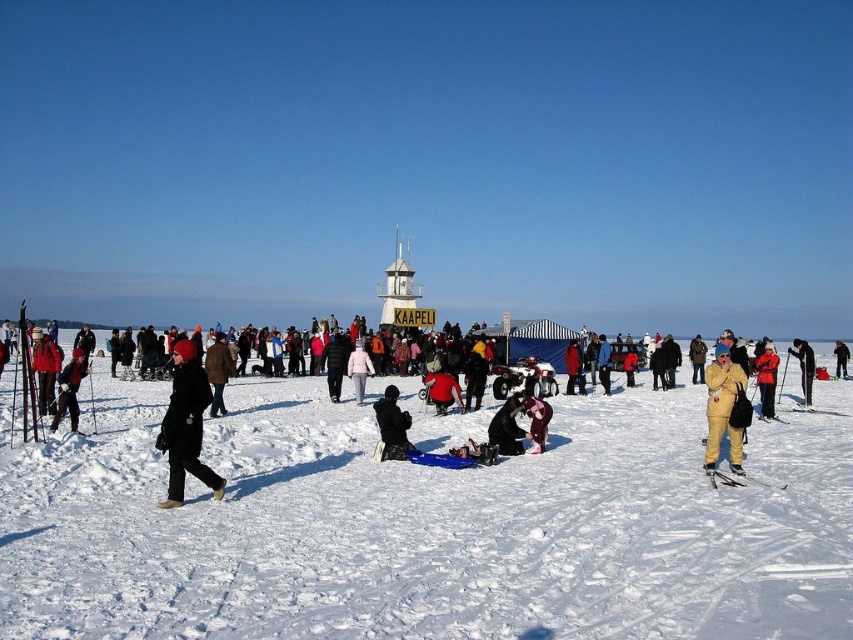
Is point (553, 586) less distant than point (27, 436)?

Yes, point (553, 586) is closer to viewer.

Consider the image. Is yellow fabric at center shorter than matte black ski at left?

Correct, yellow fabric at center is not as tall as matte black ski at left.

Between point (459, 612) and point (24, 416), which one is positioned behind?

The point (24, 416) is behind.

This screenshot has width=853, height=640. I want to click on yellow fabric at center, so click(428, 525).

Is black matte jacket at center bigger than light pink fabric coat at center?

Incorrect, black matte jacket at center is not larger than light pink fabric coat at center.

Measure the distance between black matte jacket at center and camera.

A distance of 321.36 feet exists between black matte jacket at center and camera.

Locate an element on the screen. The image size is (853, 640). black matte jacket at center is located at coordinates click(x=392, y=426).

Which of these two, metallic skis at lower right or yellow fabric person at center, stands taller?

With more height is yellow fabric person at center.

Between point (764, 484) and point (845, 349), which one is positioned in front?

Point (764, 484)

Image resolution: width=853 pixels, height=640 pixels. I want to click on metallic skis at lower right, so click(740, 480).